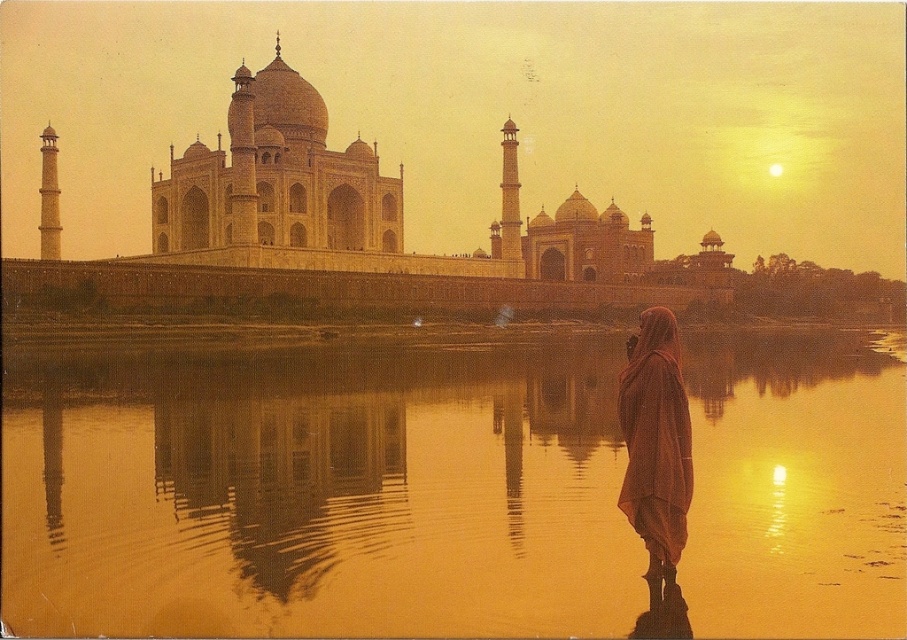
Question: Can you confirm if smooth golden water at center is wider than silky brown scarf at lower right?

Choices:
 (A) no
 (B) yes

Answer: (B)

Question: Among these objects, which one is farthest from the camera?

Choices:
 (A) smooth golden water at center
 (B) silky brown scarf at lower right

Answer: (B)

Question: Does smooth golden water at center appear under silky brown scarf at lower right?

Choices:
 (A) yes
 (B) no

Answer: (A)

Question: Does smooth golden water at center lie behind silky brown scarf at lower right?

Choices:
 (A) no
 (B) yes

Answer: (A)

Question: Which of the following is the farthest from the observer?

Choices:
 (A) smooth golden water at center
 (B) silky brown scarf at lower right

Answer: (B)